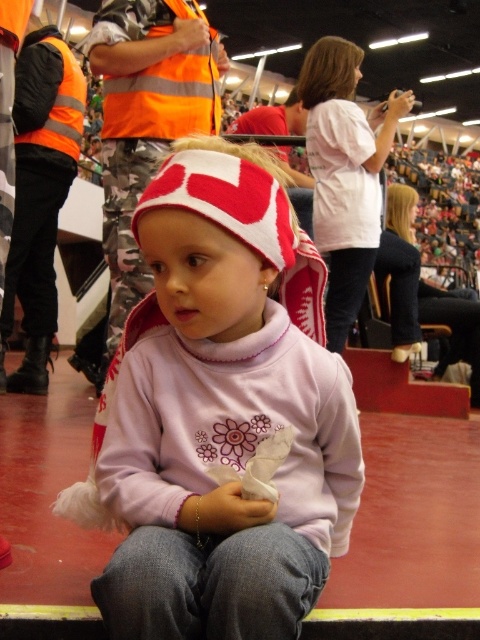
Question: Does matte pink sweater at center have a lesser width compared to matte white shirt at center?

Choices:
 (A) no
 (B) yes

Answer: (B)

Question: From the image, what is the correct spatial relationship of matte pink sweater at center in relation to matte white shirt at center?

Choices:
 (A) below
 (B) above

Answer: (A)

Question: Is matte pink sweater at center further to camera compared to matte white shirt at center?

Choices:
 (A) no
 (B) yes

Answer: (A)